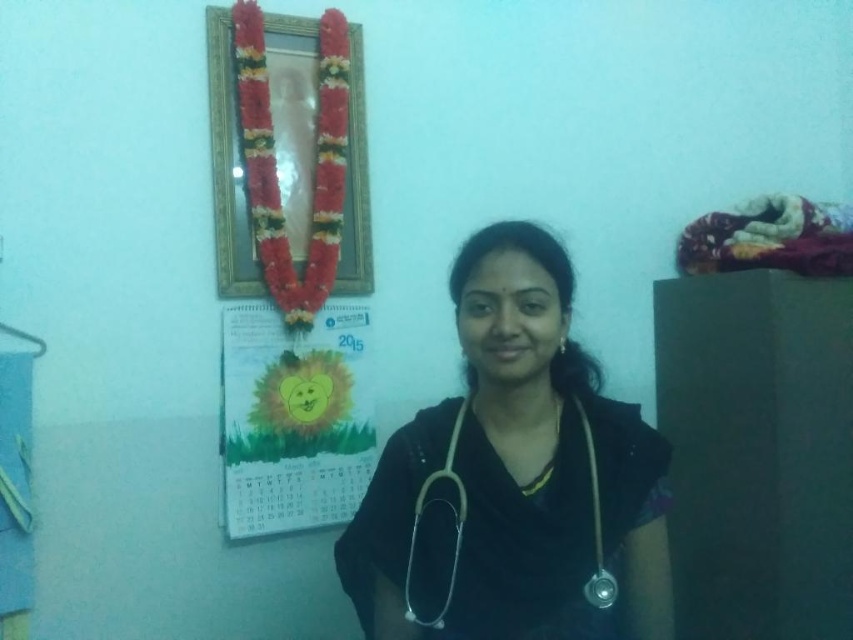
Question: Which point is farther to the camera?

Choices:
 (A) (351, 483)
 (B) (587, 544)
 (C) (345, 186)
 (D) (605, 584)

Answer: (C)

Question: Considering the relative positions of black fabric stethoscope at center and metallic silver stethoscope at center in the image provided, where is black fabric stethoscope at center located with respect to metallic silver stethoscope at center?

Choices:
 (A) below
 (B) above

Answer: (B)

Question: Does paper calendar at upper center have a smaller size compared to gold metallic frame at upper center?

Choices:
 (A) yes
 (B) no

Answer: (A)

Question: Which of the following is the farthest from the observer?

Choices:
 (A) (440, 616)
 (B) (460, 497)
 (C) (222, 432)
 (D) (210, 36)

Answer: (C)

Question: Is black fabric stethoscope at center smaller than metallic silver stethoscope at center?

Choices:
 (A) no
 (B) yes

Answer: (A)

Question: Estimate the real-world distances between objects in this image. Which object is farther from the paper calendar at upper center?

Choices:
 (A) black fabric stethoscope at center
 (B) metallic silver stethoscope at center

Answer: (B)